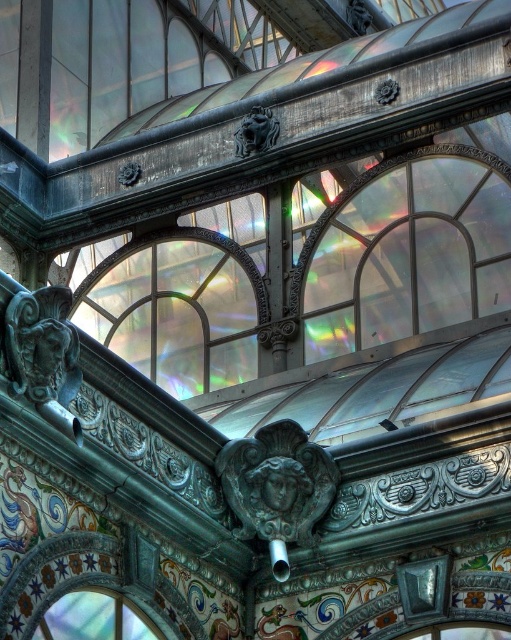
You are an architect examining the intricate metalwork and glasswork in the image. You notice a point at coordinates (x=177, y=308). What does this point mark?

The point at coordinates (x=177, y=308) marks the translucent glass window at center.

You are standing in the grand hall and looking at the intricate metal framework below the stained glass. There are two points marked on the framework. The first point is at coordinate point [140,340] and the second point is at coordinate point [64,628]. Which of these points is closer to your eyes?

Point [140,340] is further to the camera than point [64,628], so the point closer to your eyes is point [64,628].